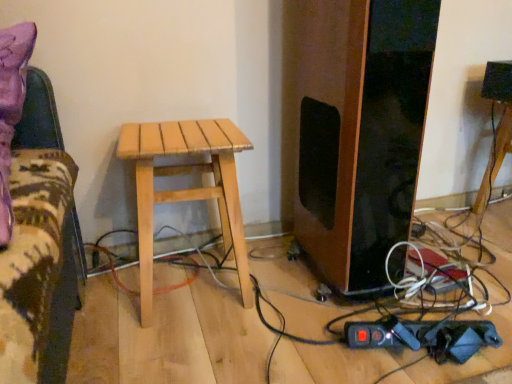
This screenshot has height=384, width=512. I want to click on vacant position to the left of natural wood stool at center, so click(x=106, y=296).